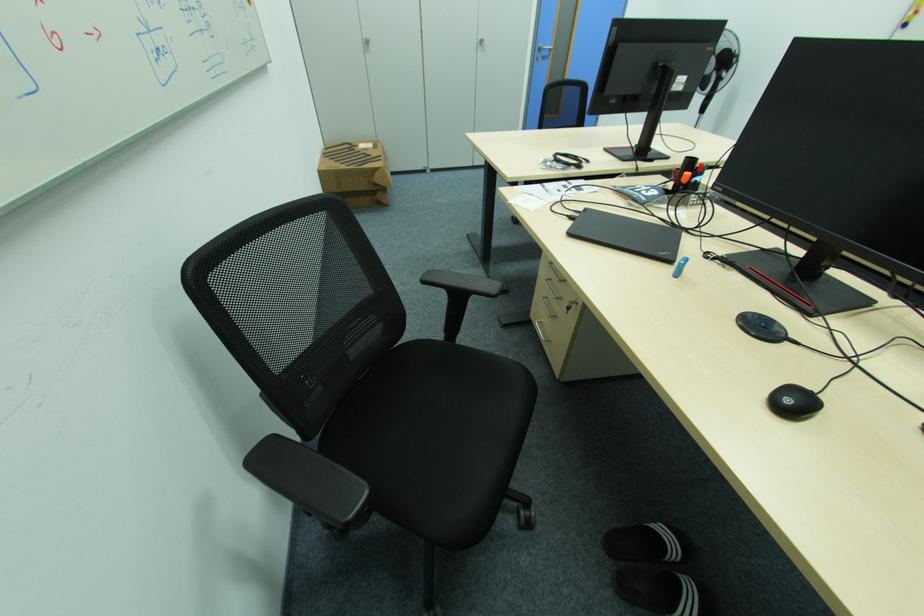
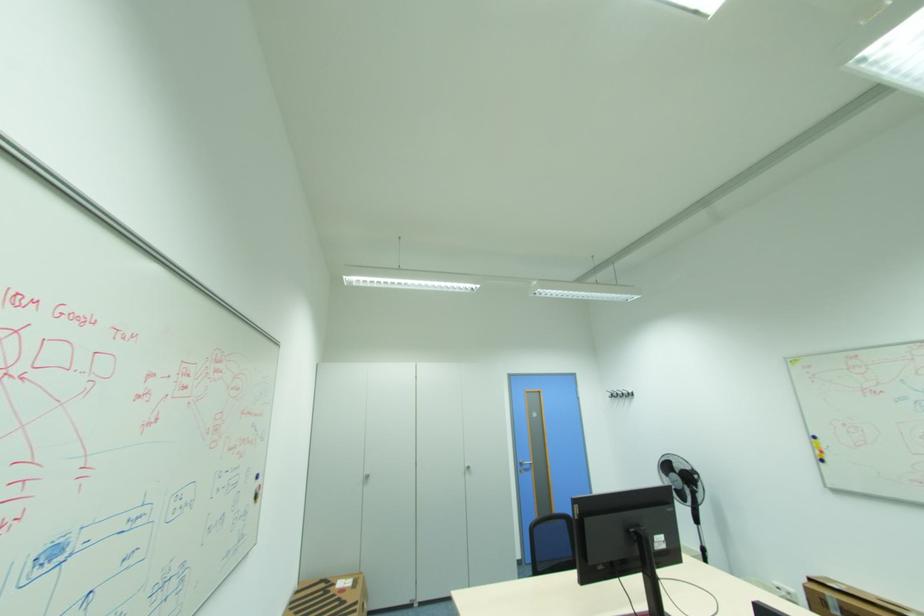
In the second image, find the point that corresponds to (361,147) in the first image.

(338, 585)